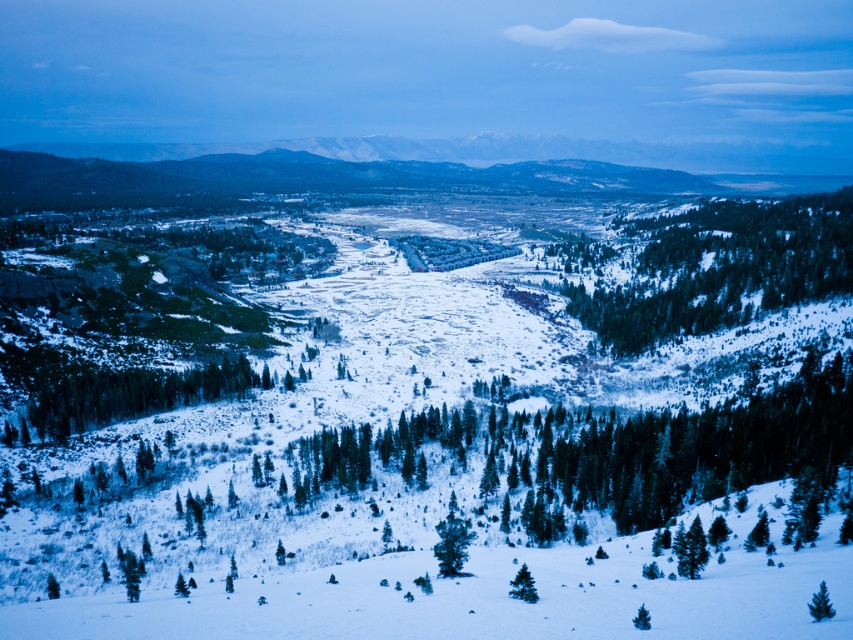
Question: Can you confirm if green matte tree at lower center is thinner than green matte tree at lower right?

Choices:
 (A) no
 (B) yes

Answer: (B)

Question: Is green textured trees at center-right positioned in front of green matte tree at lower right?

Choices:
 (A) yes
 (B) no

Answer: (B)

Question: Which point appears farthest from the camera in this image?

Choices:
 (A) (166, 372)
 (B) (531, 582)
 (C) (821, 611)
 (D) (676, 214)

Answer: (D)

Question: Which point appears closest to the camera in this image?

Choices:
 (A) [x=137, y=412]
 (B) [x=828, y=605]
 (C) [x=514, y=589]

Answer: (B)

Question: Among these objects, which one is farthest from the camera?

Choices:
 (A) green matte tree at lower right
 (B) green matte tree at lower left
 (C) green textured trees at center-right
 (D) green matte tree at lower center

Answer: (C)

Question: Is green textured trees at center-right wider than green matte tree at lower left?

Choices:
 (A) yes
 (B) no

Answer: (A)